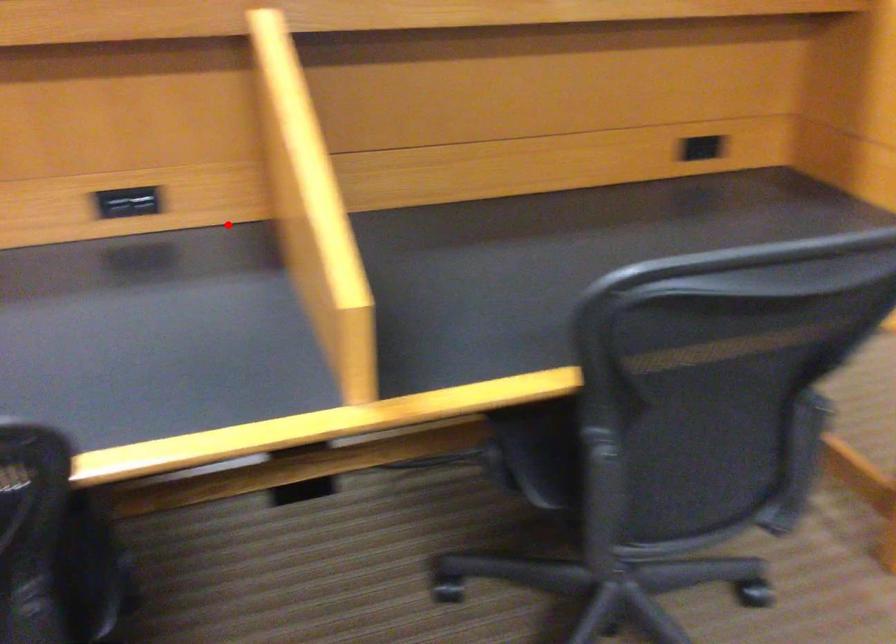
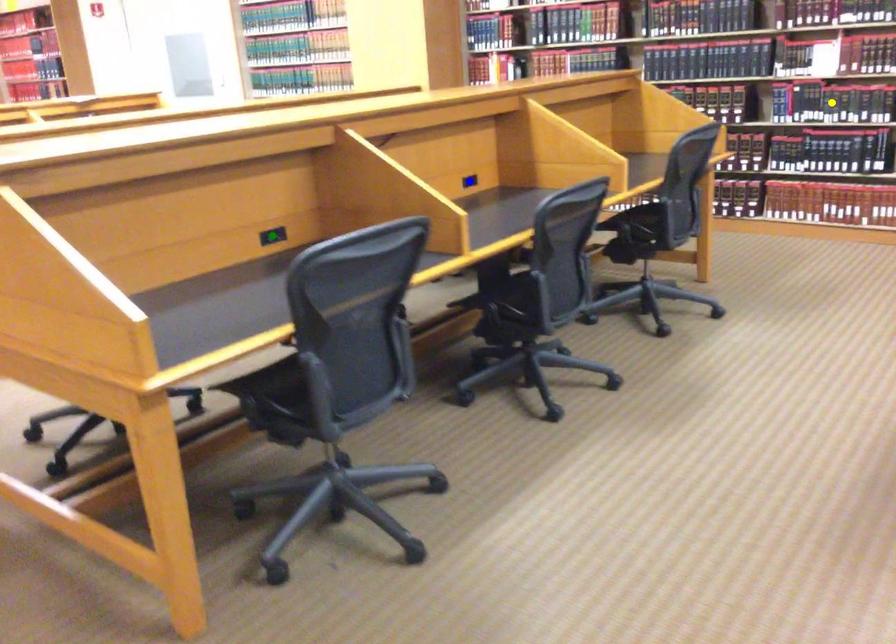
Question: I am providing you with two images of the same scene from different viewpoints. A red point is marked on the first image. You are given multiple points on the second image. Can you choose the point in image 2 that corresponds to the point in image 1?

Choices:
 (A) yellow point
 (B) blue point
 (C) green point

Answer: (B)